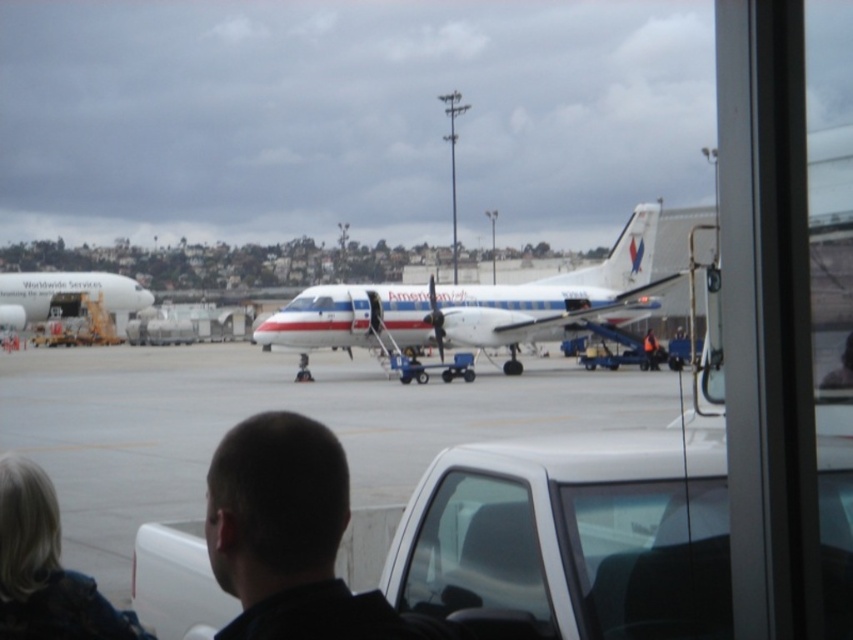
Question: Which of the following is the closest to the observer?

Choices:
 (A) (251, 492)
 (B) (10, 557)

Answer: (A)

Question: Which point is closer to the camera taking this photo?

Choices:
 (A) (635, 317)
 (B) (502, 624)

Answer: (B)

Question: Does gray concrete tarmac at center have a larger size compared to white glossy airplane at left?

Choices:
 (A) no
 (B) yes

Answer: (A)

Question: Which point is closer to the camera?

Choices:
 (A) white glossy airplane at center
 (B) orange reflective vest at center
 (C) transparent glass window at center

Answer: (C)

Question: Can you confirm if dark hair at center is positioned to the right of white glossy airplane at center?

Choices:
 (A) no
 (B) yes

Answer: (A)

Question: Can you confirm if transparent glass window at center is smaller than orange reflective vest at center?

Choices:
 (A) yes
 (B) no

Answer: (A)